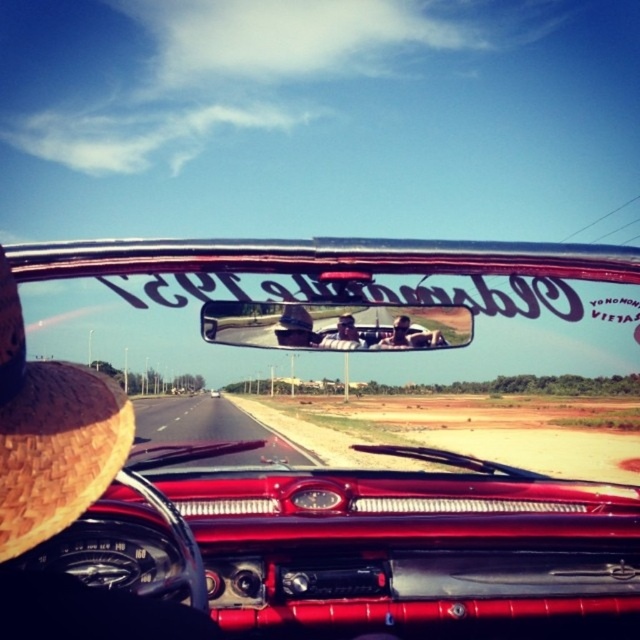
Can you confirm if brown woven straw hat at left is positioned below shiny chrome car at center?

Actually, brown woven straw hat at left is above shiny chrome car at center.

Where is `brown woven straw hat at left`? This screenshot has height=640, width=640. brown woven straw hat at left is located at coordinates (51, 435).

Can you confirm if brown woven straw hat at left is positioned above metallic chrome rearview mirror at center?

No.

Is brown woven straw hat at left to the right of metallic chrome rearview mirror at center from the viewer's perspective?

No, brown woven straw hat at left is not to the right of metallic chrome rearview mirror at center.

Where is `brown woven straw hat at left`? The height and width of the screenshot is (640, 640). brown woven straw hat at left is located at coordinates (51, 435).

Where is `brown woven straw hat at left`? The height and width of the screenshot is (640, 640). brown woven straw hat at left is located at coordinates (51, 435).

Does metallic chrome rearview mirror at center appear on the left side of shiny chrome car at center?

No, metallic chrome rearview mirror at center is not to the left of shiny chrome car at center.

Who is higher up, metallic chrome rearview mirror at center or shiny chrome car at center?

metallic chrome rearview mirror at center

Is point (266, 346) closer to viewer compared to point (216, 394)?

That is True.

Find the location of `metallic chrome rearview mirror at center`. metallic chrome rearview mirror at center is located at coordinates 336,324.